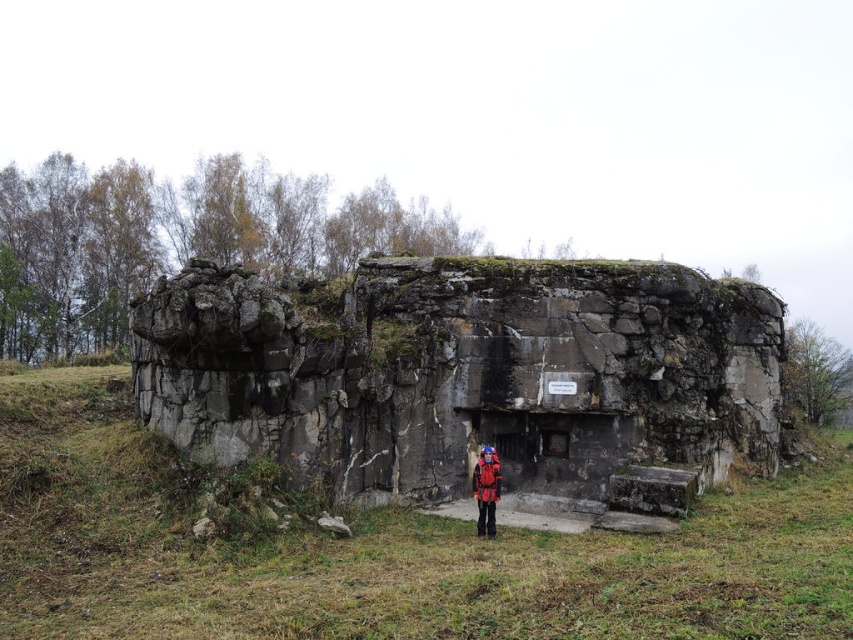
Question: Among these objects, which one is nearest to the camera?

Choices:
 (A) red fabric jacket at center
 (B) rusty stone bunker at center

Answer: (B)

Question: Does rusty stone bunker at center have a smaller size compared to red fabric jacket at center?

Choices:
 (A) no
 (B) yes

Answer: (A)

Question: Which point is closer to the camera taking this photo?

Choices:
 (A) (482, 481)
 (B) (413, 406)

Answer: (A)

Question: Can you confirm if rusty stone bunker at center is bigger than red fabric jacket at center?

Choices:
 (A) no
 (B) yes

Answer: (B)

Question: Among these points, which one is nearest to the camera?

Choices:
 (A) (177, 355)
 (B) (497, 476)

Answer: (B)

Question: Is rusty stone bunker at center below red fabric jacket at center?

Choices:
 (A) yes
 (B) no

Answer: (B)